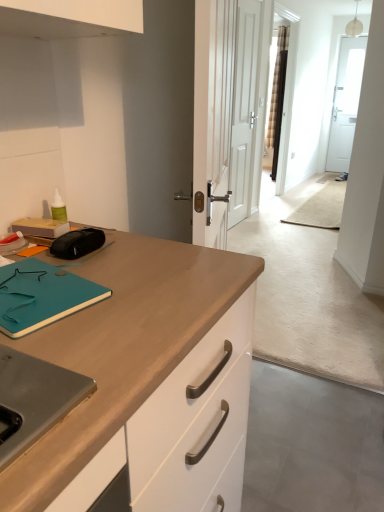
In order to click on vacant space in front of white matte door at center in this screenshot , I will do `click(254, 232)`.